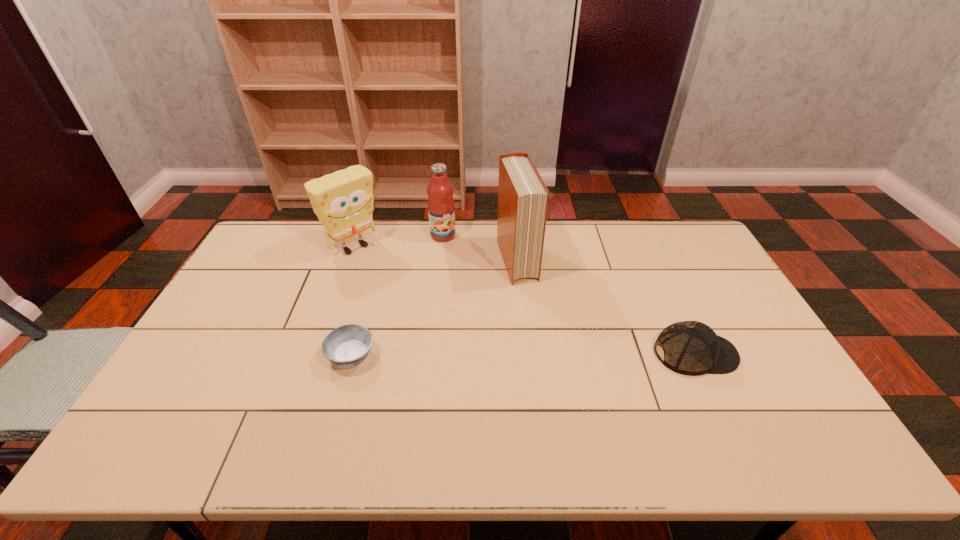
Locate an element on the screen. This screenshot has width=960, height=540. vacant space on the desktop that is between the shortest object and the cap and is positioned on the open cover of the fourth object from left to right is located at coordinates (553, 355).

Find the location of a particular element. The width and height of the screenshot is (960, 540). free spot on the desktop that is between the ashtray and the rightmost object and is positioned on the front label of the fruit juice is located at coordinates (504, 355).

In order to click on vacant space on the desktop that is between the ashtray and the cap and is positioned on the face of the sponge in this screenshot , I will do `click(476, 356)`.